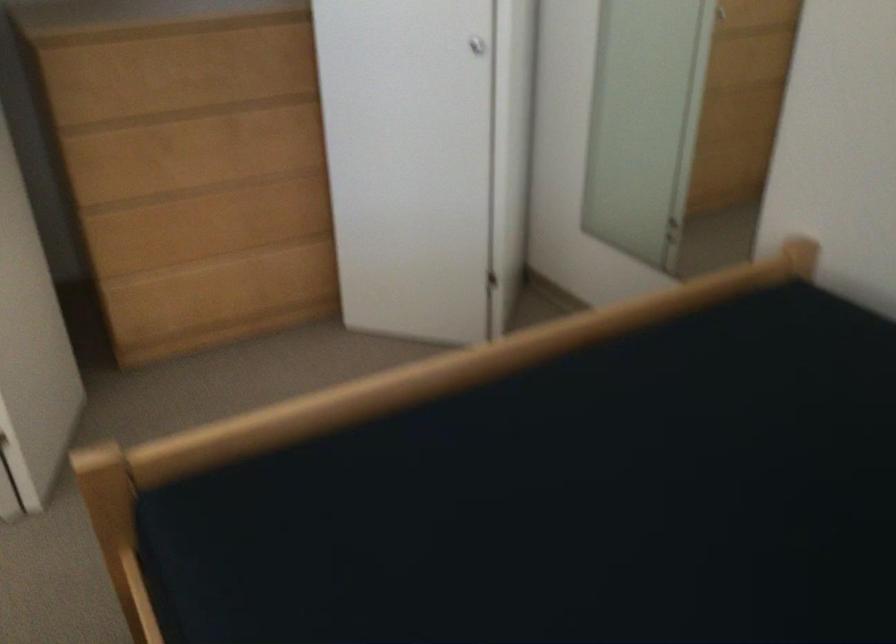
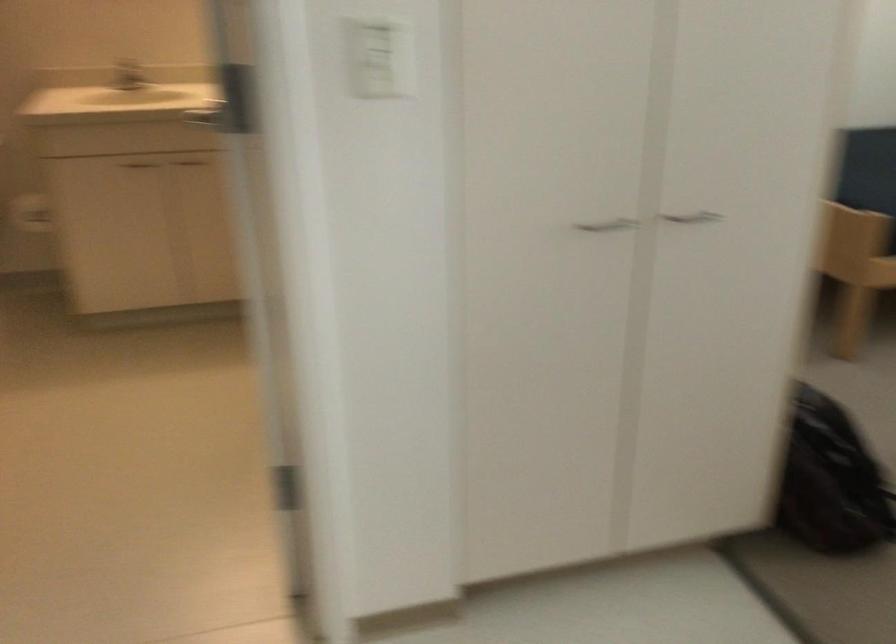
Where in the second image is the point corresponding to point (106, 520) from the first image?

(855, 269)